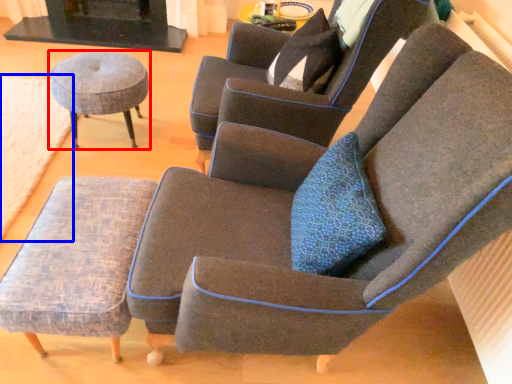
Question: Which object appears closest to the camera in this image, stool (highlighted by a red box) or mat (highlighted by a blue box)?

Choices:
 (A) stool
 (B) mat

Answer: (B)